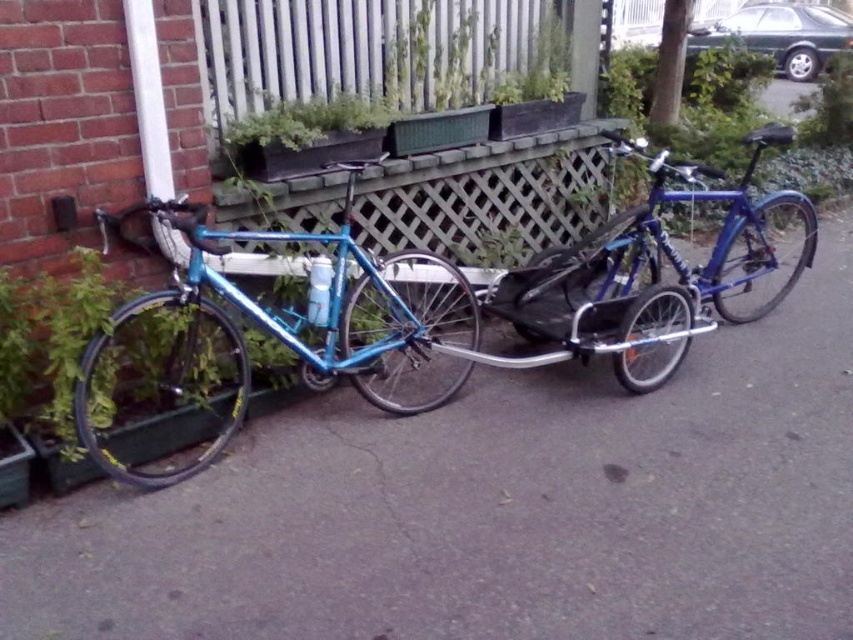
You are a delivery person who needs to move a package from the matte blue bicycle at center to the green leafy plant at center. The package is 30 inches long. Can you carry it horizontally between them without tilting it?

The distance between the matte blue bicycle at center and the green leafy plant at center is 26.99 inches. Since the package is 30 inches long, it is longer than the available space. Therefore, you cannot carry it horizontally between them without tilting it.

What are the coordinates of the blue metallic bicycle at center?

The blue metallic bicycle at center is located at coordinates point (608,280).